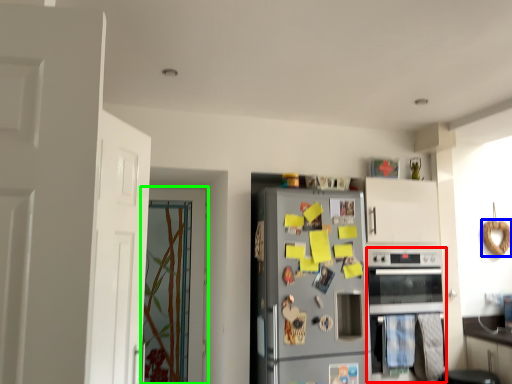
Question: Which is nearer to the oven (highlighted by a red box)? bagel (highlighted by a blue box) or door (highlighted by a green box).

Choices:
 (A) bagel
 (B) door

Answer: (A)